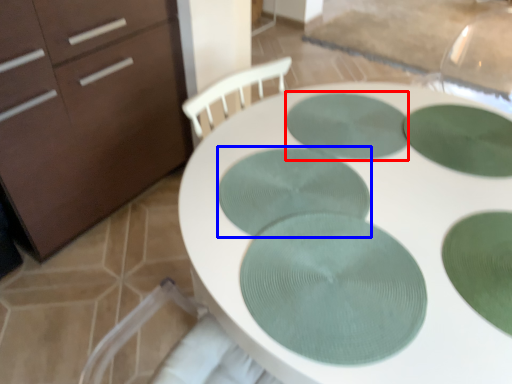
Question: Which point is closer to the camera, glass plate (highlighted by a red box) or glass plate (highlighted by a blue box)?

Choices:
 (A) glass plate
 (B) glass plate

Answer: (B)